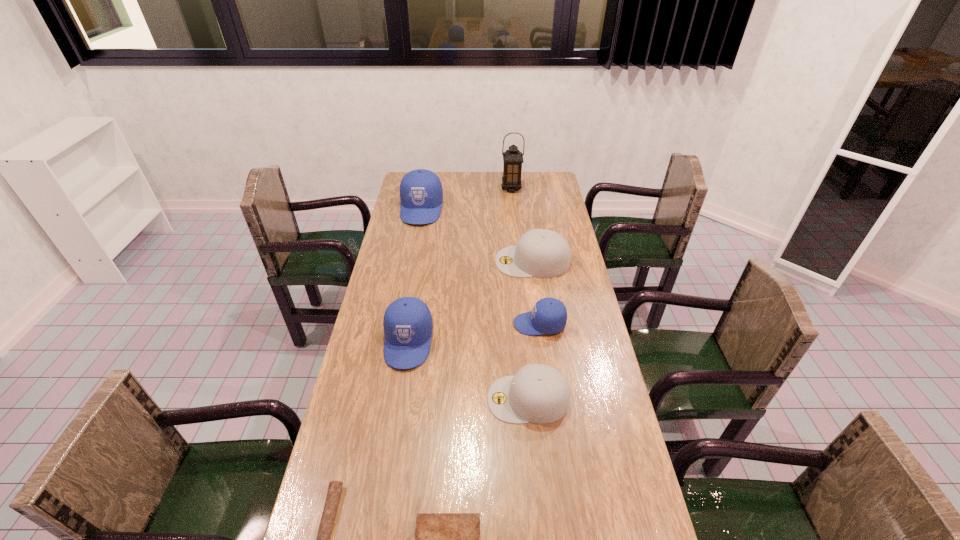
Where is `vacant region located on the right of the black lantern`? The image size is (960, 540). vacant region located on the right of the black lantern is located at coordinates (552, 188).

The height and width of the screenshot is (540, 960). I want to click on vacant area situated 0.110m on the front-facing side of the farthest cap, so click(416, 242).

This screenshot has height=540, width=960. I want to click on vacant space located on the front-facing side of the second biggest blue cap, so click(x=398, y=402).

At what (x,y) coordinates should I click in order to perform the action: click on vacant area located on the front-facing side of the third farthest object. Please return your answer as a coordinate pair (x, y). This screenshot has height=540, width=960. Looking at the image, I should click on (458, 261).

Identify the location of free space located 0.320m on the front-facing side of the third farthest object. This screenshot has height=540, width=960. (416, 261).

At what (x,y) coordinates should I click in order to perform the action: click on free location located on the front-facing side of the third farthest object. Please return your answer as a coordinate pair (x, y). The height and width of the screenshot is (540, 960). Looking at the image, I should click on (450, 261).

The image size is (960, 540). I want to click on free space located 0.380m on the front-facing side of the smaller gray cap, so click(x=358, y=399).

Image resolution: width=960 pixels, height=540 pixels. Find the location of `free location located 0.190m on the front-facing side of the smaller gray cap`. free location located 0.190m on the front-facing side of the smaller gray cap is located at coordinates (422, 399).

Image resolution: width=960 pixels, height=540 pixels. In order to click on vacant space located on the front-facing side of the smaller gray cap in this screenshot , I will do `click(385, 399)`.

Identify the location of vacant space located 0.260m on the front-facing side of the rightmost blue cap. (438, 324).